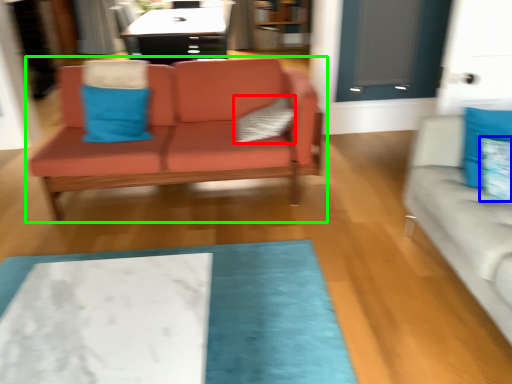
Question: Which is nearer to the pillow (highlighted by a red box)? pillow (highlighted by a blue box) or studio couch (highlighted by a green box).

Choices:
 (A) pillow
 (B) studio couch

Answer: (B)